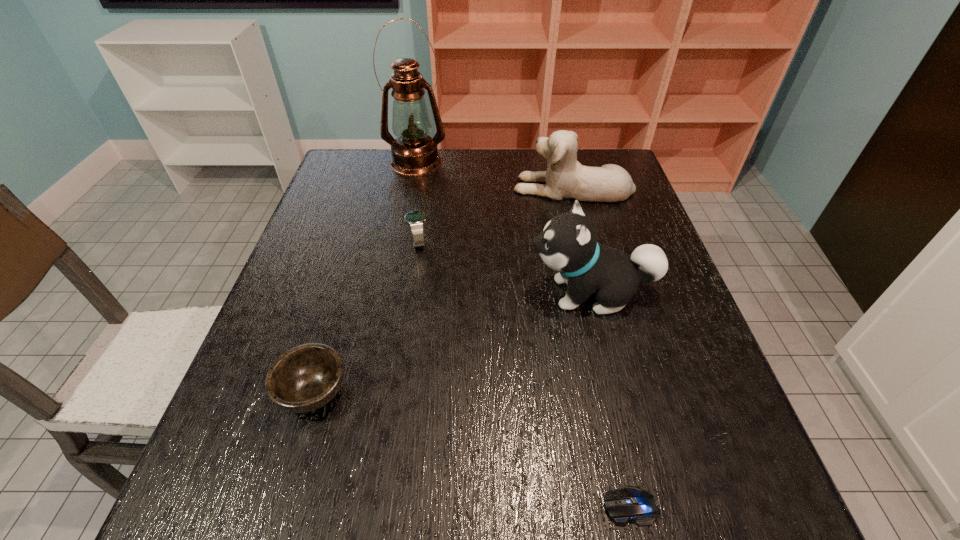
Locate an element on the screen. The image size is (960, 540). free space located 0.170m on the button side of the nearest object is located at coordinates (493, 505).

This screenshot has width=960, height=540. Find the location of `vacant position located 0.260m on the button side of the nearest object`. vacant position located 0.260m on the button side of the nearest object is located at coordinates click(436, 505).

Find the location of a particular element. The image size is (960, 540). free space located on the button side of the nearest object is located at coordinates (378, 505).

Image resolution: width=960 pixels, height=540 pixels. Find the location of `oil lamp that is at the far edge`. oil lamp that is at the far edge is located at coordinates (414, 152).

This screenshot has height=540, width=960. Find the location of `puppy at the far edge`. puppy at the far edge is located at coordinates (565, 178).

The image size is (960, 540). What are the coordinates of `object located at the near edge` in the screenshot? It's located at (631, 503).

I want to click on oil lamp located at the left edge, so click(414, 152).

Where is `bowl located at the left edge`? bowl located at the left edge is located at coordinates (305, 378).

Locate an element on the screen. This screenshot has height=540, width=960. object present at the far left corner is located at coordinates (414, 152).

The height and width of the screenshot is (540, 960). I want to click on object positioned at the far right corner, so click(x=565, y=178).